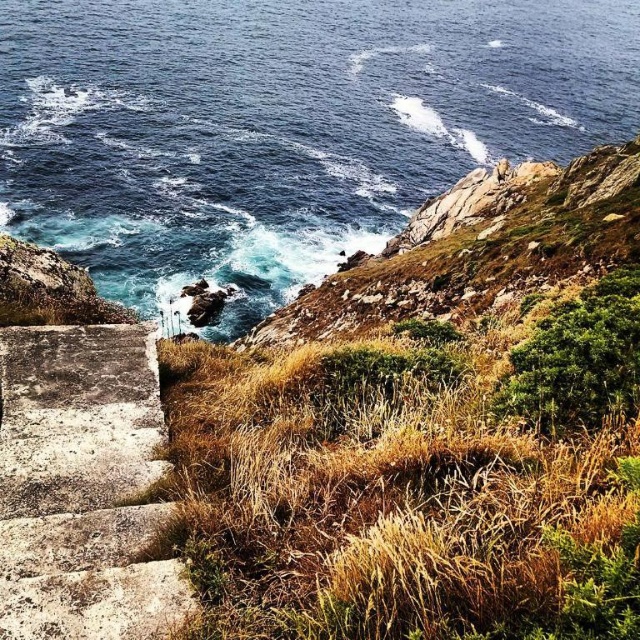
Who is positioned more to the left, blue water at upper left or concrete stairs at lower left?

From the viewer's perspective, concrete stairs at lower left appears more on the left side.

Between blue water at upper left and concrete stairs at lower left, which one is positioned higher?

blue water at upper left is higher up.

Which is in front, point (228, 88) or point (129, 544)?

Point (129, 544) is in front.

Find the location of a particular element. blue water at upper left is located at coordinates (282, 128).